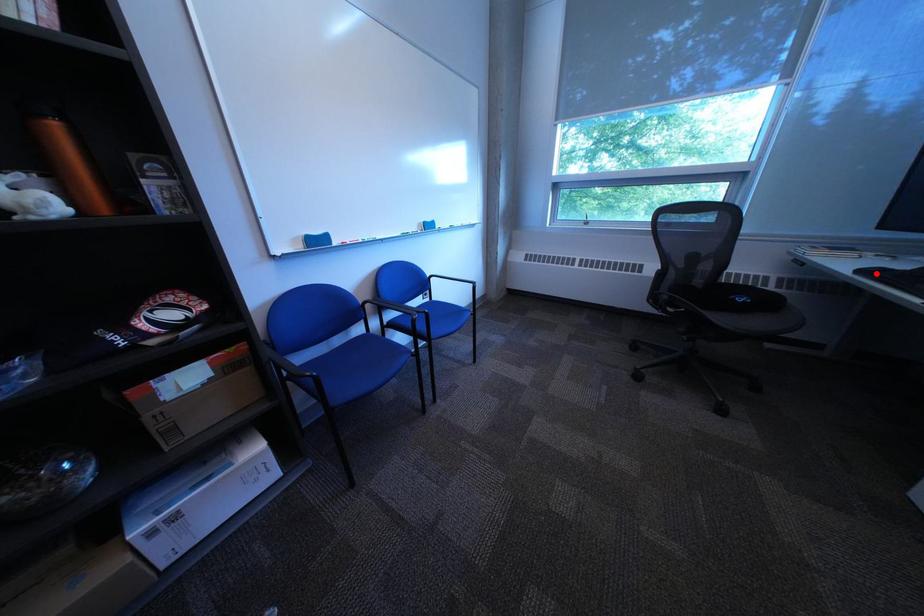
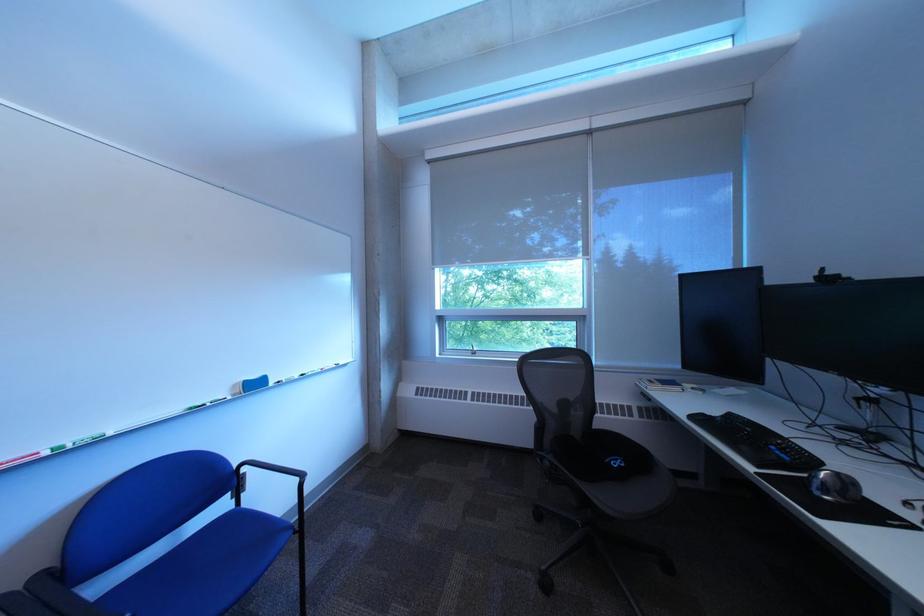
In the second image, find the point that corresponds to the highlighted location in the first image.

(708, 419)